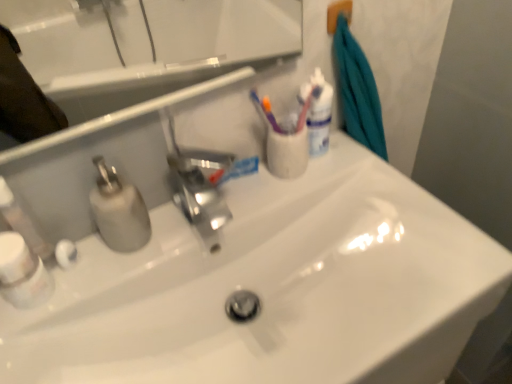
Question: Is white plastic soap dispenser at left positioned in front of white glossy sink at center?

Choices:
 (A) no
 (B) yes

Answer: (A)

Question: Considering the relative sizes of white plastic soap dispenser at left and white glossy sink at center in the image provided, is white plastic soap dispenser at left smaller than white glossy sink at center?

Choices:
 (A) yes
 (B) no

Answer: (A)

Question: From the image's perspective, does white plastic soap dispenser at left appear lower than white glossy sink at center?

Choices:
 (A) yes
 (B) no

Answer: (B)

Question: From a real-world perspective, is white plastic soap dispenser at left below white glossy sink at center?

Choices:
 (A) no
 (B) yes

Answer: (A)

Question: From a real-world perspective, is white plastic soap dispenser at left located higher than white glossy sink at center?

Choices:
 (A) yes
 (B) no

Answer: (A)

Question: In the image, is white plastic soap dispenser at left on the left side or the right side of white glossy sink at center?

Choices:
 (A) left
 (B) right

Answer: (A)

Question: Is point (25, 213) positioned closer to the camera than point (423, 251)?

Choices:
 (A) farther
 (B) closer

Answer: (B)

Question: From the image's perspective, is white plastic soap dispenser at left above or below white glossy sink at center?

Choices:
 (A) above
 (B) below

Answer: (A)

Question: In the image, is white plastic soap dispenser at left positioned in front of or behind white glossy sink at center?

Choices:
 (A) behind
 (B) front

Answer: (A)

Question: From a real-world perspective, is white glossy toothpaste at center positioned above or below white glossy mouthwash at upper right, which is the first mouthwash in top-to-bottom order?

Choices:
 (A) below
 (B) above

Answer: (A)

Question: Is white glossy toothpaste at center in front of or behind white glossy mouthwash at upper right, which is counted as the first mouthwash, starting from the back, in the image?

Choices:
 (A) front
 (B) behind

Answer: (B)

Question: From the image's perspective, is white glossy toothpaste at center above or below white glossy mouthwash at upper right, which is the first mouthwash in top-to-bottom order?

Choices:
 (A) below
 (B) above

Answer: (A)

Question: In the image, is white glossy toothpaste at center on the left side or the right side of white glossy mouthwash at upper right, which appears as the 2th mouthwash when viewed from the front?

Choices:
 (A) right
 (B) left

Answer: (B)

Question: Considering the positions of white plastic bottle at lower left, the 2th mouthwash viewed from the top, and white plastic soap dispenser at left in the image, is white plastic bottle at lower left, the 2th mouthwash viewed from the top, taller or shorter than white plastic soap dispenser at left?

Choices:
 (A) short
 (B) tall

Answer: (A)

Question: Is white plastic bottle at lower left, the second mouthwash positioned from the right, wider or thinner than white plastic soap dispenser at left?

Choices:
 (A) wide
 (B) thin

Answer: (A)